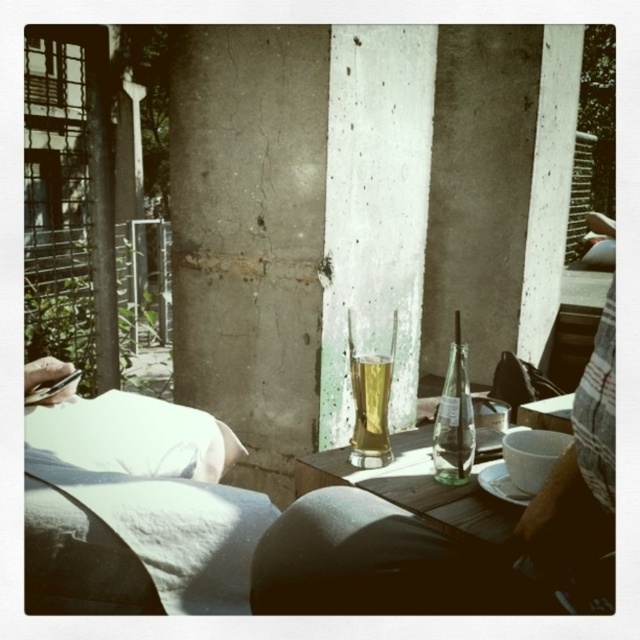
Question: Which point is closer to the camera taking this photo?

Choices:
 (A) (387, 596)
 (B) (362, 374)
 (C) (554, 424)
 (D) (452, 392)

Answer: (A)

Question: Estimate the real-world distances between objects in this image. Which object is farther from the clear glass beer at center?

Choices:
 (A) clear glass bottle at center
 (B) clear glass table at center
 (C) translucent glass beer at center

Answer: (C)

Question: Is clear glass table at center smaller than translucent glass beer at center?

Choices:
 (A) yes
 (B) no

Answer: (B)

Question: Which object is positioned farthest from the clear glass beer at center?

Choices:
 (A) clear glass bottle at center
 (B) clear glass table at center
 (C) translucent glass beer at center

Answer: (C)

Question: In this image, where is clear glass beer at center located relative to clear glass table at center?

Choices:
 (A) left
 (B) right

Answer: (A)

Question: Does clear glass beer at center have a greater width compared to clear glass table at center?

Choices:
 (A) no
 (B) yes

Answer: (A)